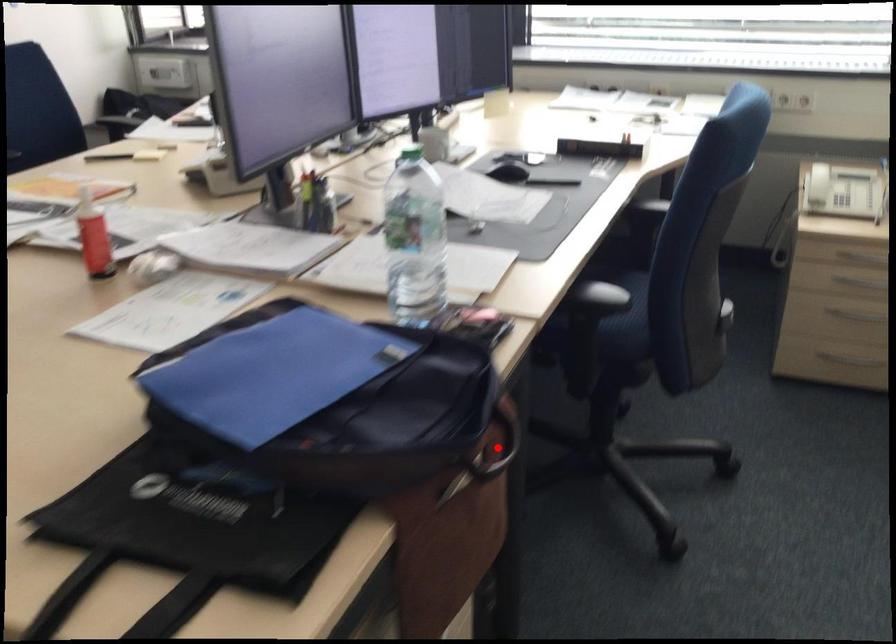
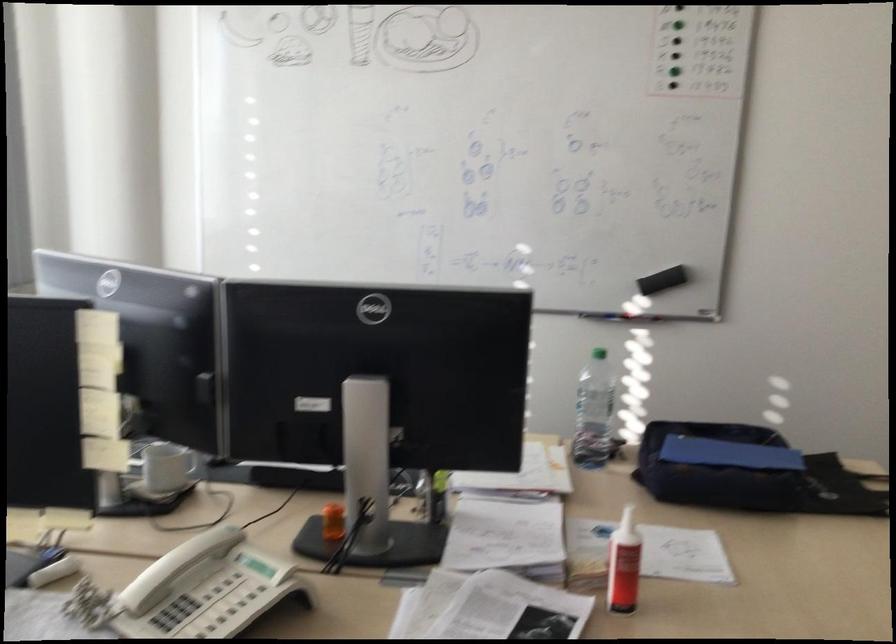
Question: I am providing you with two images of the same scene from different viewpoints. A red point is marked on the first image. Is the red point's position out of view in image 2?

Choices:
 (A) Yes
 (B) No

Answer: (A)